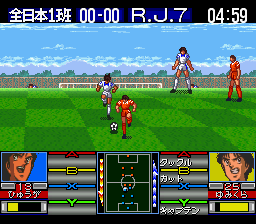
I want to click on time clock, so click(x=236, y=208).